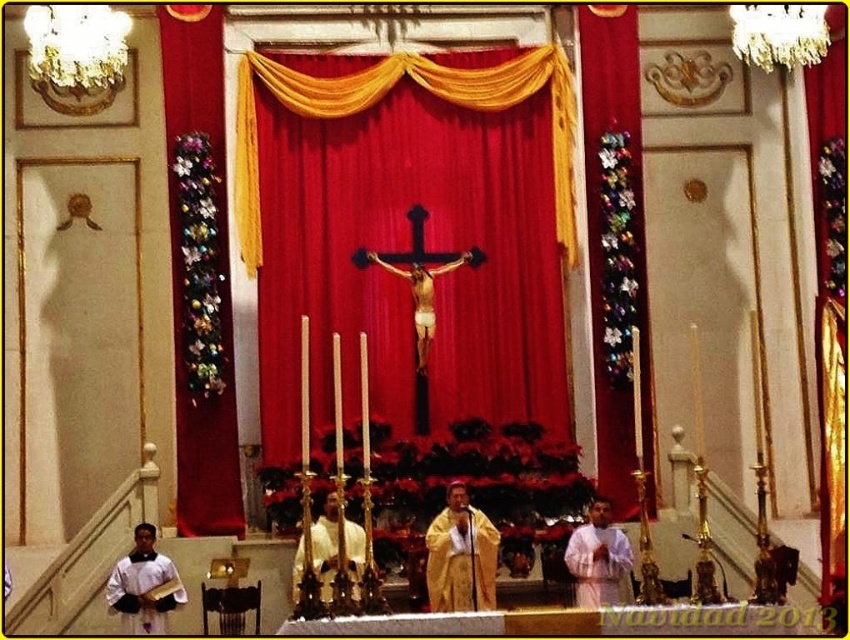
Looking at this image, does white matte robe at lower left appear under wooden crucifix at center?

Yes.

Can you confirm if white matte robe at lower left is shorter than wooden crucifix at center?

No, white matte robe at lower left is not shorter than wooden crucifix at center.

Who is more forward, [153,564] or [367,252]?

Point [153,564]

The width and height of the screenshot is (850, 640). In order to click on white matte robe at lower left in this screenshot , I will do pyautogui.click(x=143, y=589).

In the scene shown: Does shiny metallic tinsel at left appear under golden silk robe at center?

Actually, shiny metallic tinsel at left is above golden silk robe at center.

Is shiny metallic tinsel at left shorter than golden silk robe at center?

In fact, shiny metallic tinsel at left may be taller than golden silk robe at center.

Does point (207, 188) lie behind point (477, 522)?

Yes, it is.

Where is `shiny metallic tinsel at left`? shiny metallic tinsel at left is located at coordinates (200, 278).

What do you see at coordinates (383, 96) in the screenshot? I see `red velvet curtain at center` at bounding box center [383, 96].

Who is more forward, (335, 99) or (491, 536)?

Positioned in front is point (491, 536).

At what (x,y) coordinates should I click in order to perform the action: click on red velvet curtain at center. Please return your answer as a coordinate pair (x, y). Looking at the image, I should click on (383, 96).